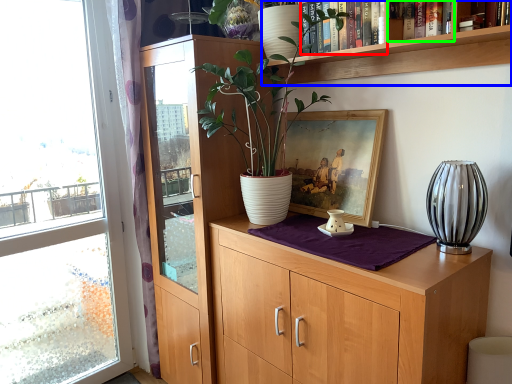
Question: Which object is the farthest from book (highlighted by a red box)? Choose among these: shelf (highlighted by a blue box) or book (highlighted by a green box).

Choices:
 (A) shelf
 (B) book

Answer: (B)